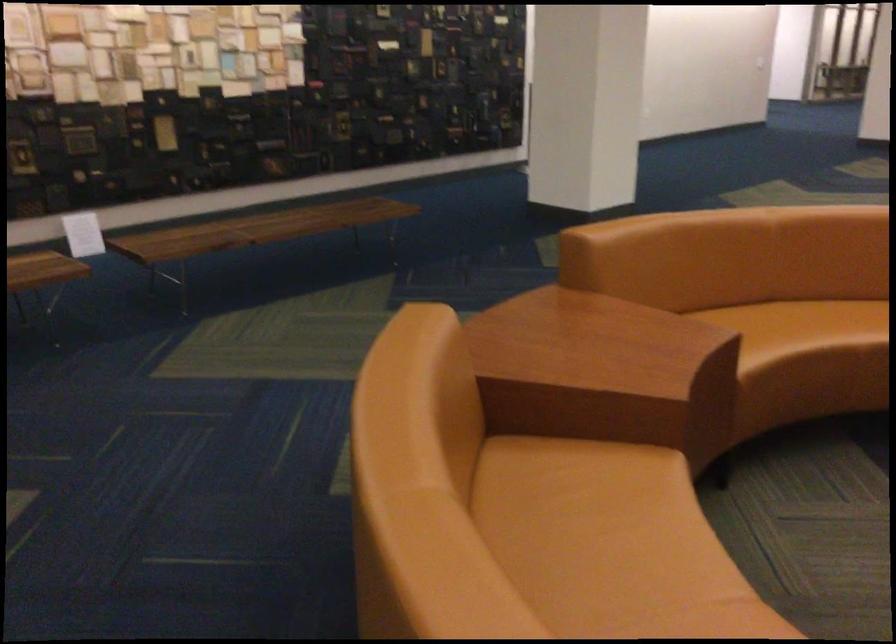
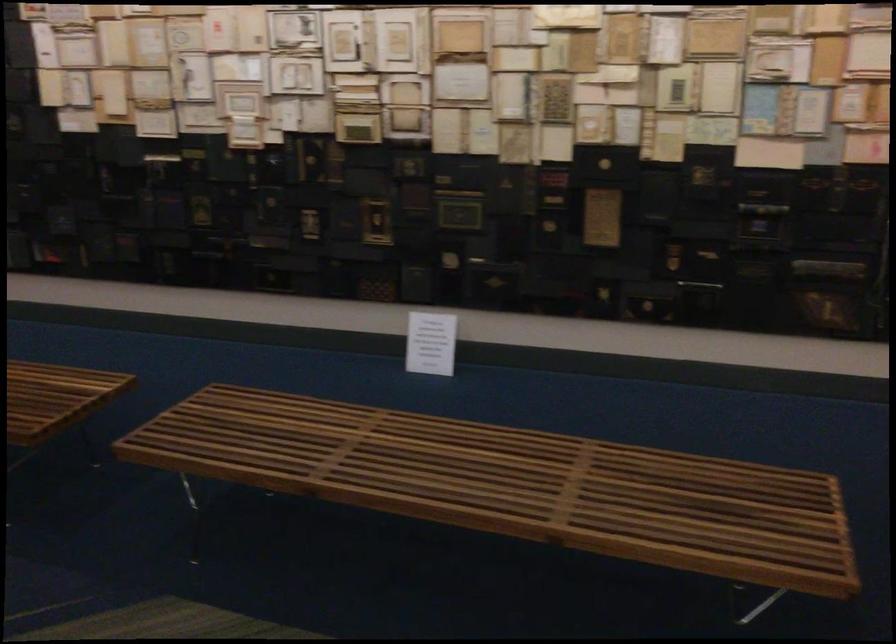
Find the pixel in the second image that matches [291,219] in the first image.

(501, 475)